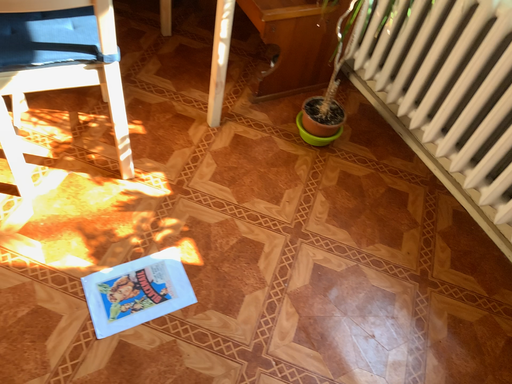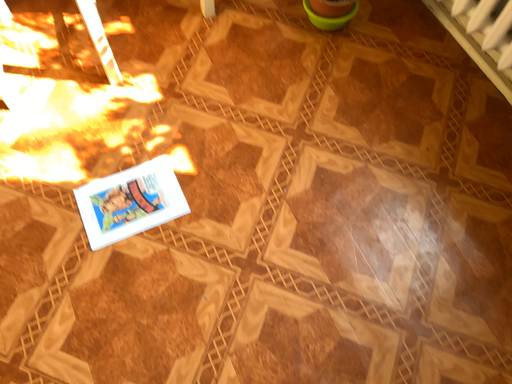
Question: How did the camera likely rotate when shooting the video?

Choices:
 (A) rotated downward
 (B) rotated upward

Answer: (A)